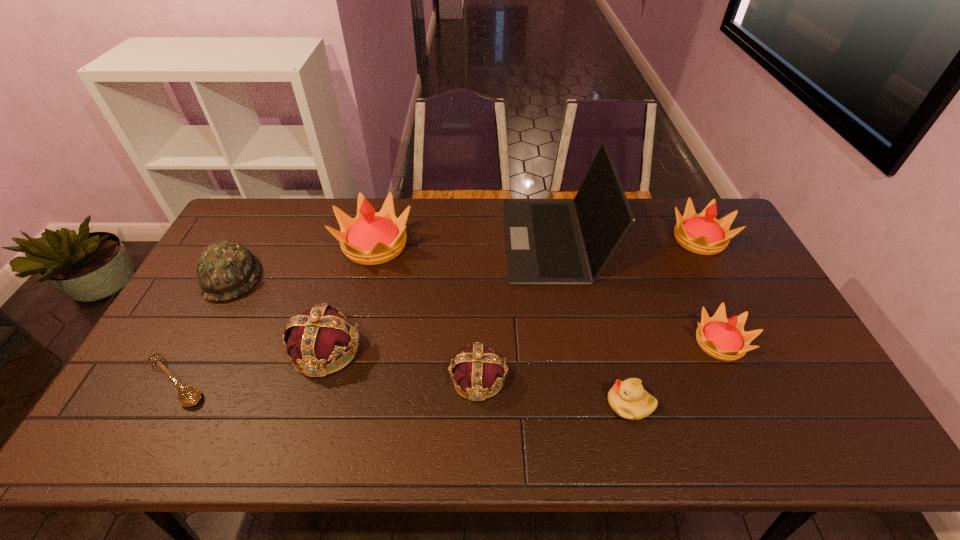
Identify the location of vacant space at the far edge. The width and height of the screenshot is (960, 540). (293, 238).

In the image, there is a desktop. Where is `vacant space at the near edge`? This screenshot has width=960, height=540. vacant space at the near edge is located at coordinates (309, 417).

Locate an element on the screen. vacant space at the right edge of the desktop is located at coordinates (773, 319).

Locate an element on the screen. This screenshot has width=960, height=540. vacant area between the right purple crown and the second tallest object is located at coordinates (426, 312).

The width and height of the screenshot is (960, 540). Find the location of `free space between the tallest crown and the smaller purple crown`. free space between the tallest crown and the smaller purple crown is located at coordinates (426, 312).

Locate an element on the screen. The width and height of the screenshot is (960, 540). empty location between the second biggest yellow crown and the smaller purple crown is located at coordinates (588, 309).

The image size is (960, 540). Find the location of `unoccupied area between the smaller purple crown and the yellow duckling`. unoccupied area between the smaller purple crown and the yellow duckling is located at coordinates (554, 391).

The height and width of the screenshot is (540, 960). In order to click on free space that is in between the third crown from right to left and the yellow duckling in this screenshot , I will do `click(554, 391)`.

This screenshot has width=960, height=540. Identify the location of vacant area that lies between the nearest yellow crown and the laptop. tap(636, 291).

Where is `vacant space that's between the second biggest yellow crown and the smaller purple crown`? Image resolution: width=960 pixels, height=540 pixels. vacant space that's between the second biggest yellow crown and the smaller purple crown is located at coordinates (588, 309).